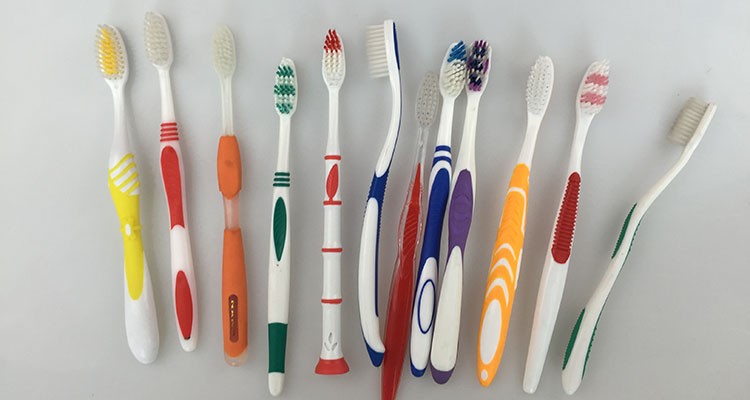
The width and height of the screenshot is (750, 400). What are the coordinates of `front of toothbrush` in the screenshot? It's located at (120, 106), (169, 99), (226, 99), (285, 138), (330, 117), (422, 145), (444, 135), (466, 129), (529, 130), (578, 141).